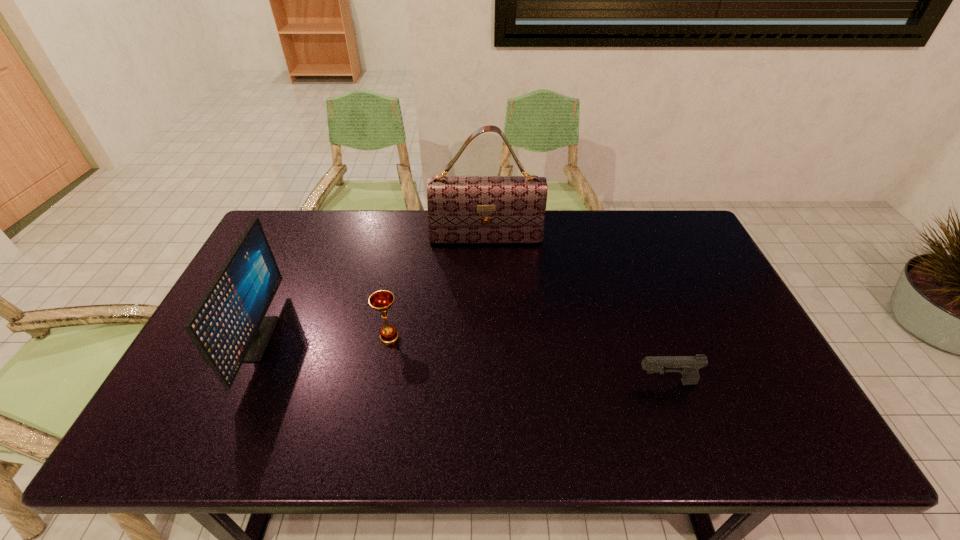
The image size is (960, 540). In the image, there is a desktop. Find the location of `vacant area at the far right corner`. vacant area at the far right corner is located at coordinates (659, 240).

The image size is (960, 540). I want to click on free space between the second shortest object and the rightmost object, so click(528, 360).

Identify the location of free space between the tallest object and the second shortest object. (438, 288).

This screenshot has height=540, width=960. Find the location of `empty space between the handbag and the third object from right to left`. empty space between the handbag and the third object from right to left is located at coordinates (438, 288).

You are a GUI agent. You are given a task and a screenshot of the screen. Output one action in this format:
    pyautogui.click(x=<x>, y=<y>)
    Task: Click on the empty space between the leftmost object and the farthest object
    The image size is (960, 540).
    Given the screenshot: What is the action you would take?
    pyautogui.click(x=371, y=289)

The image size is (960, 540). Identify the location of free space between the rightmost object and the tallest object. (x=576, y=311).

Where is `vacant space in between the handbag and the third shortest object`? The width and height of the screenshot is (960, 540). vacant space in between the handbag and the third shortest object is located at coordinates (371, 289).

You are a GUI agent. You are given a task and a screenshot of the screen. Output one action in this format:
    pyautogui.click(x=<x>, y=<y>)
    Task: Click on the free point between the third object from left to right and the third shortest object
    The width and height of the screenshot is (960, 540).
    Given the screenshot: What is the action you would take?
    pyautogui.click(x=371, y=289)

I want to click on vacant area that lies between the handbag and the shortest object, so click(x=576, y=311).

The width and height of the screenshot is (960, 540). Identify the location of free space that is in between the chalice and the handbag. pyautogui.click(x=438, y=288).